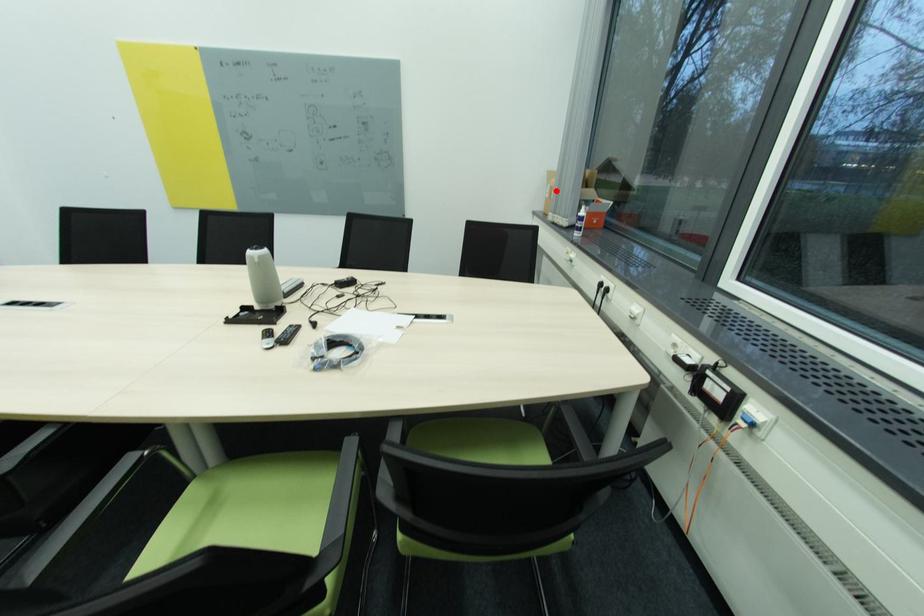
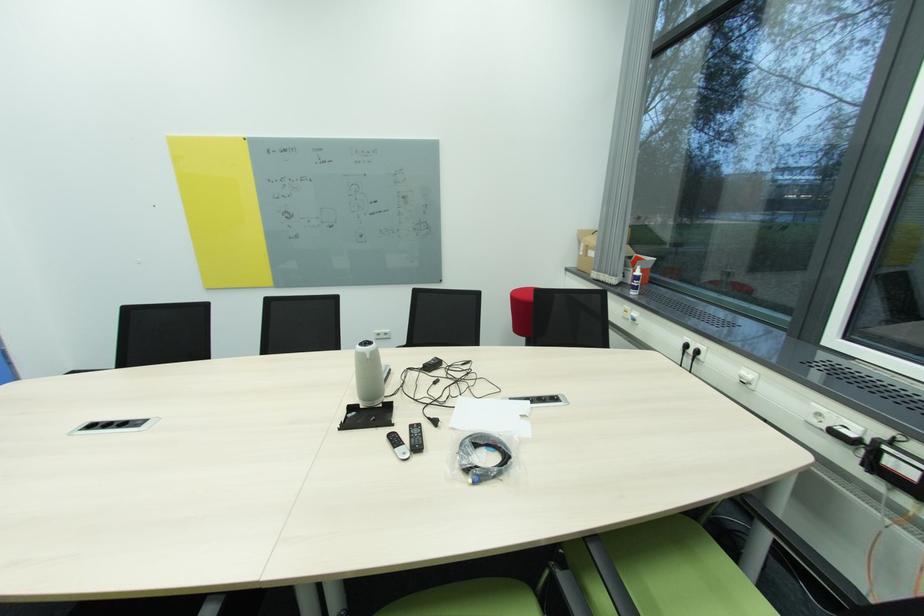
Where in the second image is the point corresponding to the highlighted location from the first image?

(591, 249)